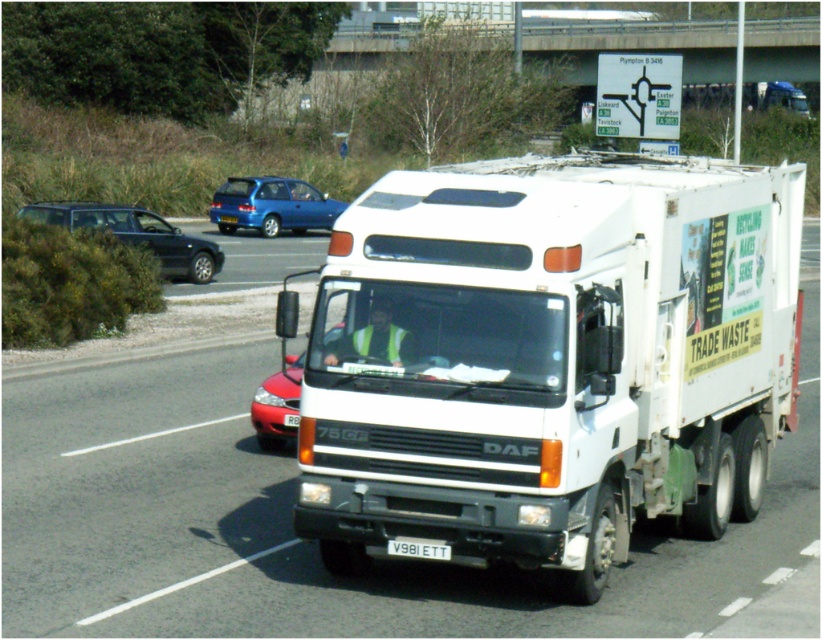
You are a pedestrian standing at point A. You see two points marked on the road ahead of you. The first point is at point B with coordinates point (279, 374) and the second point is at point C with coordinates point (134, 218). If you want to walk to the point that is further away from your current position, which point should you go to?

Point C at coordinates point (134, 218) is further away from your current position because it is behind point B at point (279, 374), meaning it is located at a greater distance from where you are standing.

You are a delivery driver who needs to park your truck next to the shiny black sedan at left and the metallic blue hatchback at upper center. Based on their widths, which vehicle should you park closer to in order to maximize space efficiency?

The shiny black sedan at left has a lesser width compared to the metallic blue hatchback at upper center, so you should park closer to the shiny black sedan at left to maximize space efficiency.

You are a pedestrian standing at point A and need to cross the road to point B. The points are labeled as follows in the image. Point A is at coordinate point [114,218] and point B is at coordinate point [428,554]. Considering the road layout and vehicle movements in the scene, which direction should you move to reach point B from point A?

Point [114,218] is behind point [428,554], so you should move forward in the direction towards point B to reach it from point A.